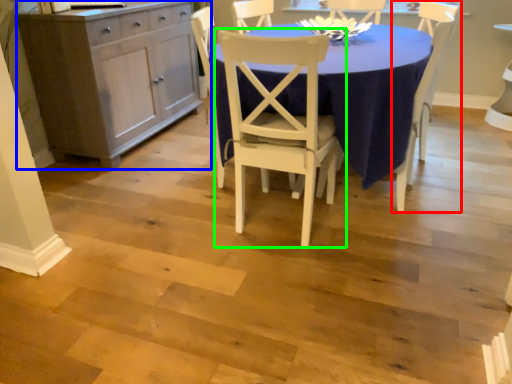
Question: Which is farther away from chair (highlighted by a red box)? cabinetry (highlighted by a blue box) or chair (highlighted by a green box)?

Choices:
 (A) cabinetry
 (B) chair

Answer: (A)